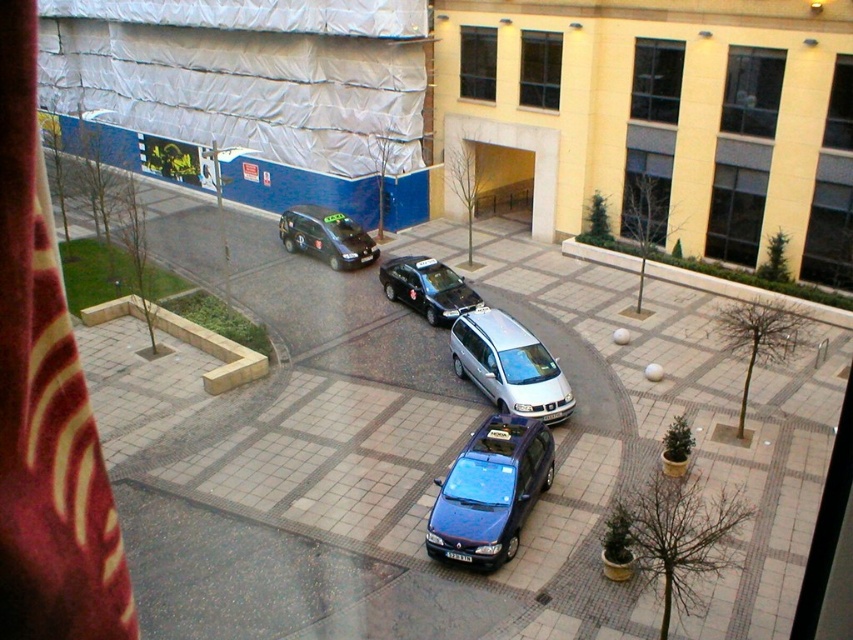
Question: Does black glossy taxi at center appear on the right side of shiny black car at center?

Choices:
 (A) yes
 (B) no

Answer: (A)

Question: Which of the following is the closest to the observer?

Choices:
 (A) shiny black car at center
 (B) silver metallic minivan at center
 (C) black glossy taxi at center
 (D) glossy blue car at center

Answer: (D)

Question: Which is farther from the metallic silver van at center?

Choices:
 (A) silver metallic minivan at center
 (B) black glossy taxi at center

Answer: (B)

Question: Can you confirm if glossy blue car at center is positioned above silver metallic minivan at center?

Choices:
 (A) no
 (B) yes

Answer: (A)

Question: Can you confirm if metallic silver van at center is positioned to the left of black glossy taxi at center?

Choices:
 (A) yes
 (B) no

Answer: (A)

Question: Which is nearer to the shiny black car at center?

Choices:
 (A) silver metallic minivan at center
 (B) metallic silver van at center
 (C) black glossy taxi at center

Answer: (C)